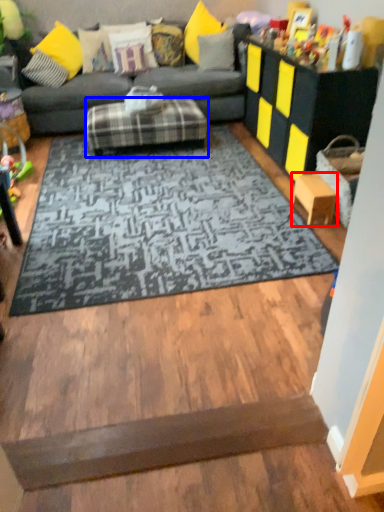
Question: Which object appears closest to the camera in this image, stool (highlighted by a red box) or footrest (highlighted by a blue box)?

Choices:
 (A) stool
 (B) footrest

Answer: (A)